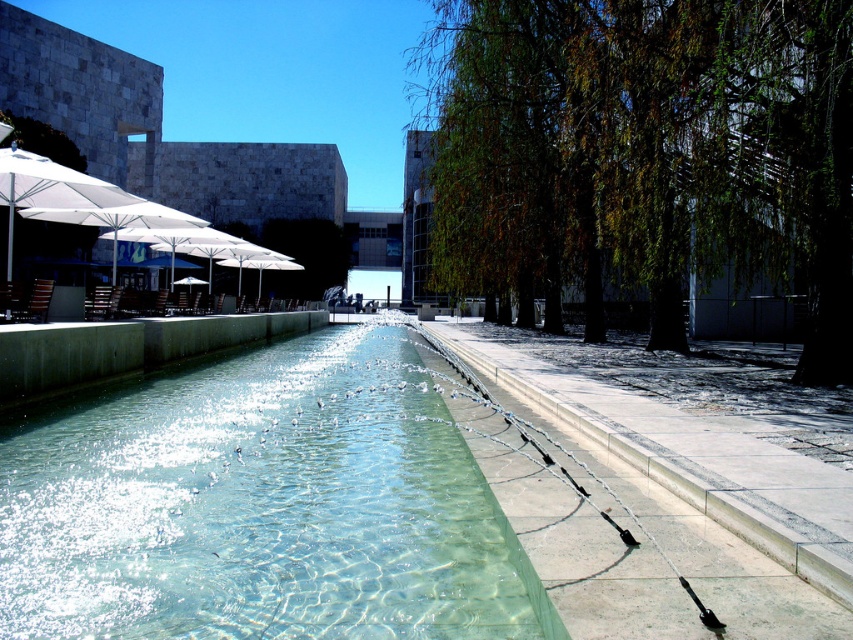
You are a visitor standing at the white fabric umbrella at left and want to walk to the clear glass pool at center. Which direction should you move to reach it?

You should move to your right to reach the clear glass pool at center since it is located to the right of the white fabric umbrella at left.

You are standing at the water feature and want to reach both the point at coordinates point (x=410, y=616) and point (x=33, y=157). Which point should you go to first to minimize the total distance traveled?

You should go to point (x=410, y=616) first because it is closer to you than point (x=33, y=157), so going there first minimizes the total distance traveled.

You are standing at the entrance of the complex and want to locate the clear glass pool at center. According to the coordinates provided, where should you look relative to the entrance?

The clear glass pool at center is located at coordinates point (260, 506), which means it is positioned to the right and slightly forward from the entrance.